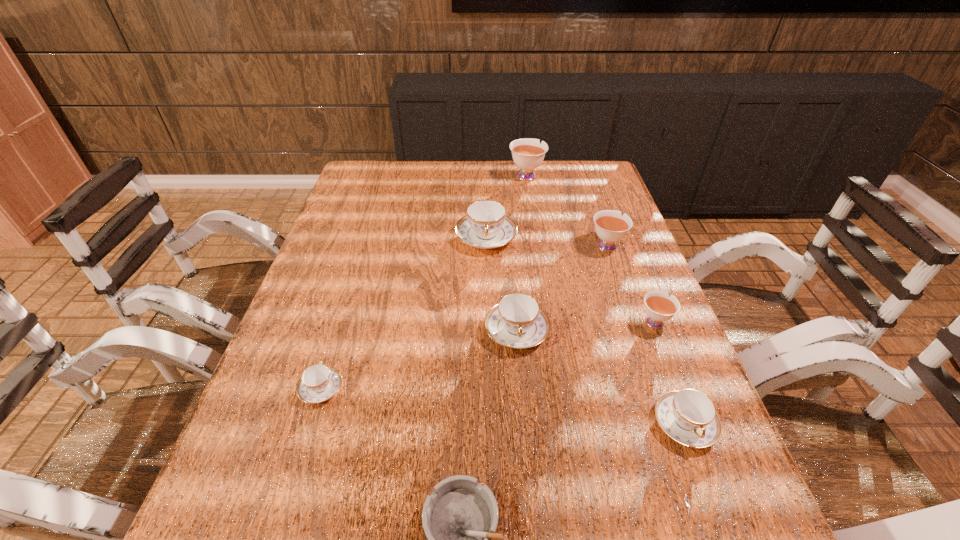
Find the location of a particular element. the leftmost white teacup is located at coordinates (528, 153).

This screenshot has height=540, width=960. What are the coordinates of `the farthest teacup` in the screenshot? It's located at (528, 153).

Locate an element on the screen. the farthest blue teacup is located at coordinates (486, 225).

This screenshot has width=960, height=540. Identify the location of the second smallest white teacup. (610, 225).

I want to click on the third smallest blue teacup, so click(517, 321).

Locate an element on the screen. This screenshot has width=960, height=540. the nearest white teacup is located at coordinates (659, 307).

This screenshot has height=540, width=960. I want to click on the third biggest blue teacup, so click(688, 416).

The height and width of the screenshot is (540, 960). What are the coordinates of `the shortest teacup` in the screenshot? It's located at (319, 382).

You are a GUI agent. You are given a task and a screenshot of the screen. Output one action in this format:
    pyautogui.click(x=<x>, y=<y>)
    Task: Click on the leftmost blue teacup
    This screenshot has height=540, width=960.
    Given the screenshot: What is the action you would take?
    pyautogui.click(x=319, y=382)

Find the location of a particular element. The image size is (960, 540). vacant space situated 0.070m on the side with the handle of the biggest blue teacup is located at coordinates (487, 274).